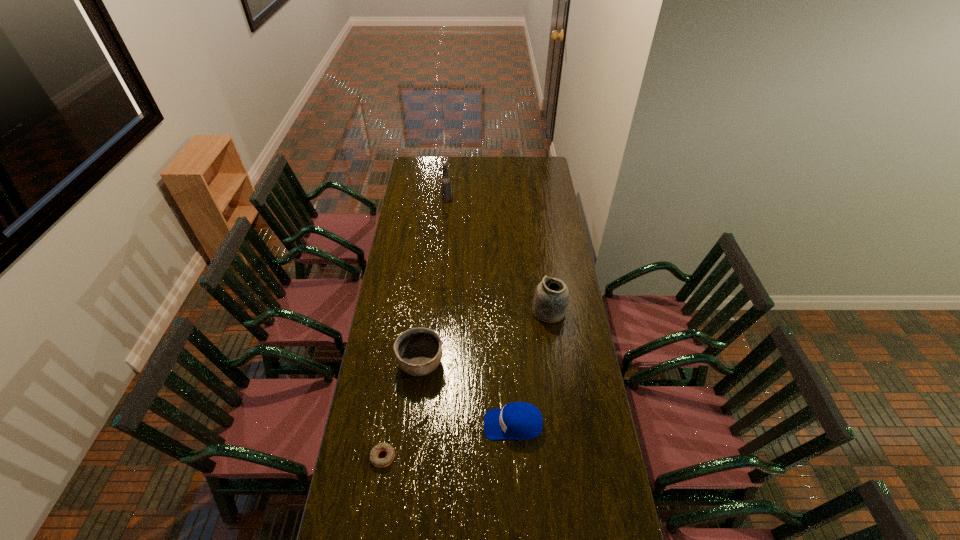
This screenshot has height=540, width=960. What are the coordinates of `vacant region located on the back of the rightmost object` in the screenshot? It's located at (546, 288).

The height and width of the screenshot is (540, 960). Find the location of `blank area located on the back of the third shortest object`. blank area located on the back of the third shortest object is located at coordinates (428, 298).

Where is `vacant space situated on the front-facing side of the baseball cap`? vacant space situated on the front-facing side of the baseball cap is located at coordinates (382, 424).

You are a GUI agent. You are given a task and a screenshot of the screen. Output one action in this format:
    pyautogui.click(x=<x>, y=<y>)
    Task: Click on the free space located on the front-facing side of the baseball cap
    Image resolution: width=960 pixels, height=540 pixels.
    Given the screenshot: What is the action you would take?
    [379, 424]

The image size is (960, 540). Find the location of `vacant region located on the front-facing side of the baseball cap`. vacant region located on the front-facing side of the baseball cap is located at coordinates (382, 424).

The image size is (960, 540). What are the coordinates of `vacant region located on the back of the doughnut` in the screenshot? It's located at (388, 426).

This screenshot has height=540, width=960. What are the coordinates of `pottery at the left edge` in the screenshot? It's located at (418, 351).

Find the location of a particular element. doughnut located at the left edge is located at coordinates (375, 460).

Identify the location of object that is at the right edge. This screenshot has height=540, width=960. (551, 299).

Find the location of a particular element. The height and width of the screenshot is (540, 960). free space at the far edge is located at coordinates (458, 172).